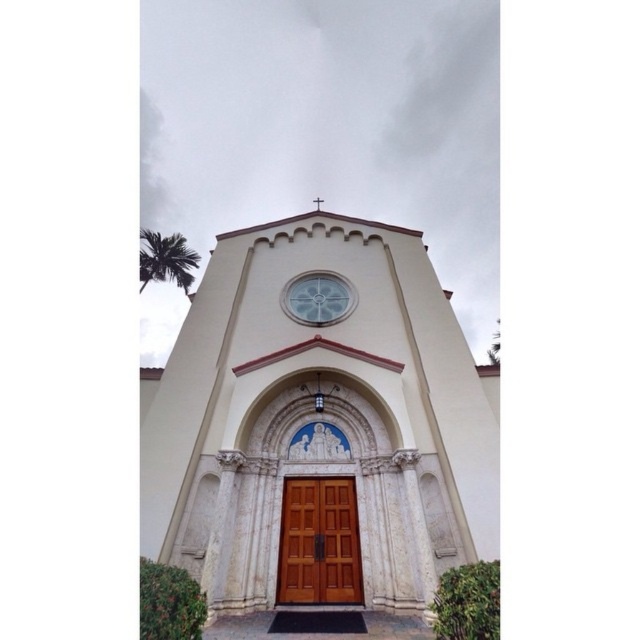
Does point (461, 372) come closer to viewer compared to point (296, 301)?

That is True.

The height and width of the screenshot is (640, 640). Identify the location of smooth beige stone church at center. (320, 428).

Can you confirm if smooth beige stone church at center is positioned to the right of wooden door at center?

In fact, smooth beige stone church at center is to the left of wooden door at center.

Is smooth beige stone church at center in front of wooden door at center?

Yes, smooth beige stone church at center is closer to the viewer.

Image resolution: width=640 pixels, height=640 pixels. Find the location of `smooth beige stone church at center`. smooth beige stone church at center is located at coordinates (320, 428).

Where is `smooth beige stone church at center`? This screenshot has height=640, width=640. smooth beige stone church at center is located at coordinates (320, 428).

Between wooden door at center and clear glass clock at center, which one has less height?

With less height is clear glass clock at center.

Consider the image. Who is higher up, wooden door at center or clear glass clock at center?

clear glass clock at center is higher up.

Which is in front, point (292, 528) or point (294, 285)?

Point (292, 528) is in front.

Where is `wooden door at center`? wooden door at center is located at coordinates (317, 541).